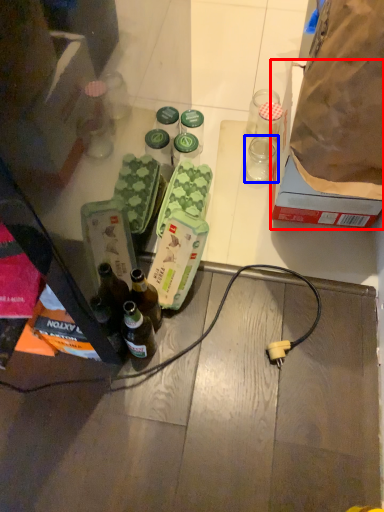
Question: Which object appears closest to the camera in this image, box (highlighted by a red box) or coffee cup (highlighted by a blue box)?

Choices:
 (A) box
 (B) coffee cup

Answer: (A)